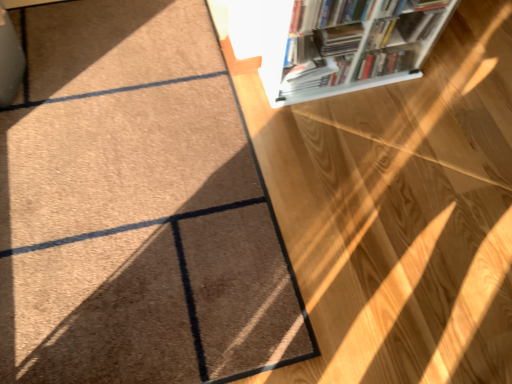
Question: Does white plastic bookcase at upper right have a smaller size compared to brown carpet at upper left?

Choices:
 (A) no
 (B) yes

Answer: (A)

Question: Is white plastic bookcase at upper right at the right side of brown carpet at upper left?

Choices:
 (A) yes
 (B) no

Answer: (A)

Question: Is white plastic bookcase at upper right behind brown carpet at upper left?

Choices:
 (A) yes
 (B) no

Answer: (A)

Question: Would you say white plastic bookcase at upper right contains brown carpet at upper left?

Choices:
 (A) no
 (B) yes

Answer: (A)

Question: Considering the relative sizes of white plastic bookcase at upper right and brown carpet at upper left in the image provided, is white plastic bookcase at upper right wider than brown carpet at upper left?

Choices:
 (A) yes
 (B) no

Answer: (B)

Question: Can you confirm if white plastic bookcase at upper right is positioned to the left of brown carpet at upper left?

Choices:
 (A) yes
 (B) no

Answer: (B)

Question: Is brown carpet at upper left positioned in front of white plastic bookcase at upper right?

Choices:
 (A) no
 (B) yes

Answer: (B)

Question: From a real-world perspective, is brown carpet at upper left beneath white plastic bookcase at upper right?

Choices:
 (A) yes
 (B) no

Answer: (A)

Question: Does brown carpet at upper left have a lesser height compared to white plastic bookcase at upper right?

Choices:
 (A) yes
 (B) no

Answer: (A)

Question: Is brown carpet at upper left oriented towards white plastic bookcase at upper right?

Choices:
 (A) yes
 (B) no

Answer: (B)

Question: Considering the relative sizes of brown carpet at upper left and white plastic bookcase at upper right in the image provided, is brown carpet at upper left thinner than white plastic bookcase at upper right?

Choices:
 (A) yes
 (B) no

Answer: (B)

Question: Considering the relative positions of brown carpet at upper left and white plastic bookcase at upper right in the image provided, is brown carpet at upper left to the right of white plastic bookcase at upper right from the viewer's perspective?

Choices:
 (A) yes
 (B) no

Answer: (B)

Question: Based on their positions, is brown carpet at upper left located to the left or right of white plastic bookcase at upper right?

Choices:
 (A) right
 (B) left

Answer: (B)